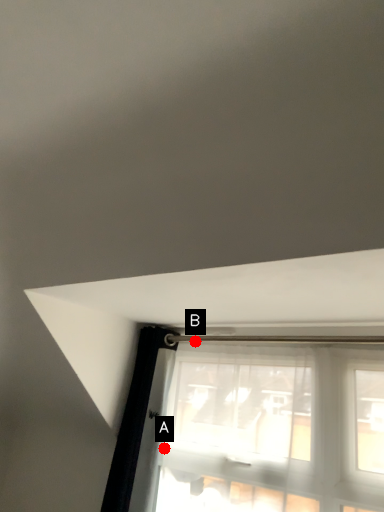
Question: Two points are circled on the image, labeled by A and B beside each circle. Which point is closer to the camera?

Choices:
 (A) A is closer
 (B) B is closer

Answer: (A)